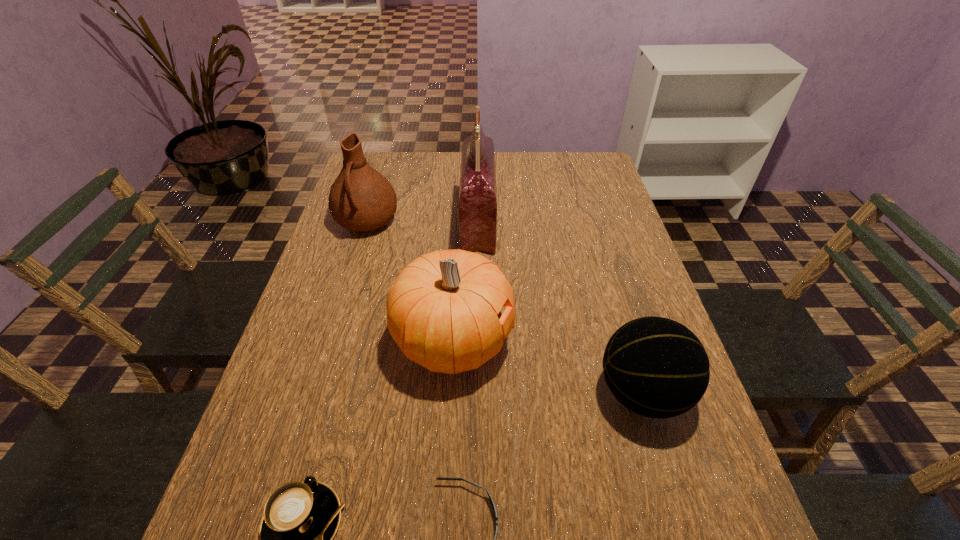
Find the location of a particular element. This screenshot has height=540, width=960. the tallest object is located at coordinates (477, 206).

Image resolution: width=960 pixels, height=540 pixels. I want to click on pitcher, so click(x=361, y=199).

Locate an element on the screen. pumpkin is located at coordinates (443, 311).

At what (x,y) coordinates should I click in order to perform the action: click on basketball. Please return your answer as a coordinate pair (x, y). Image resolution: width=960 pixels, height=540 pixels. Looking at the image, I should click on (656, 367).

Locate an element on the screen. The height and width of the screenshot is (540, 960). the rightmost object is located at coordinates (656, 367).

You are a GUI agent. You are given a task and a screenshot of the screen. Output one action in this format:
    pyautogui.click(x=<x>, y=<y>)
    Task: Click on the vacant region located on the front-facing side of the handbag
    The width and height of the screenshot is (960, 540).
    Given the screenshot: What is the action you would take?
    pyautogui.click(x=531, y=222)

Where is `free region located 0.160m on the side of the pitcher with the handle`? This screenshot has width=960, height=540. free region located 0.160m on the side of the pitcher with the handle is located at coordinates (348, 283).

Locate an element on the screen. The image size is (960, 540). free region located 0.100m on the front-facing side of the pumpkin is located at coordinates (556, 341).

The image size is (960, 540). I want to click on vacant space positioned on the back of the rightmost object, so click(x=609, y=280).

Identify the location of object that is at the left edge. (361, 199).